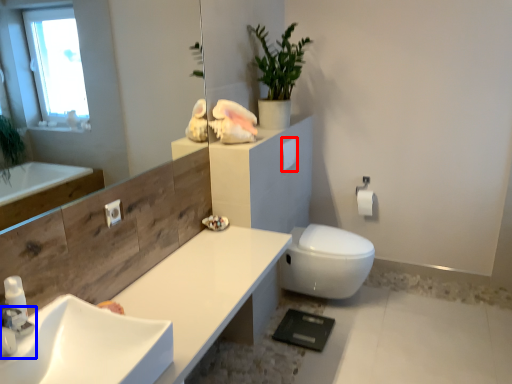
Question: Which of the following is the farthest to the observer, toilet paper (highlighted by a red box) or tap (highlighted by a blue box)?

Choices:
 (A) toilet paper
 (B) tap

Answer: (A)